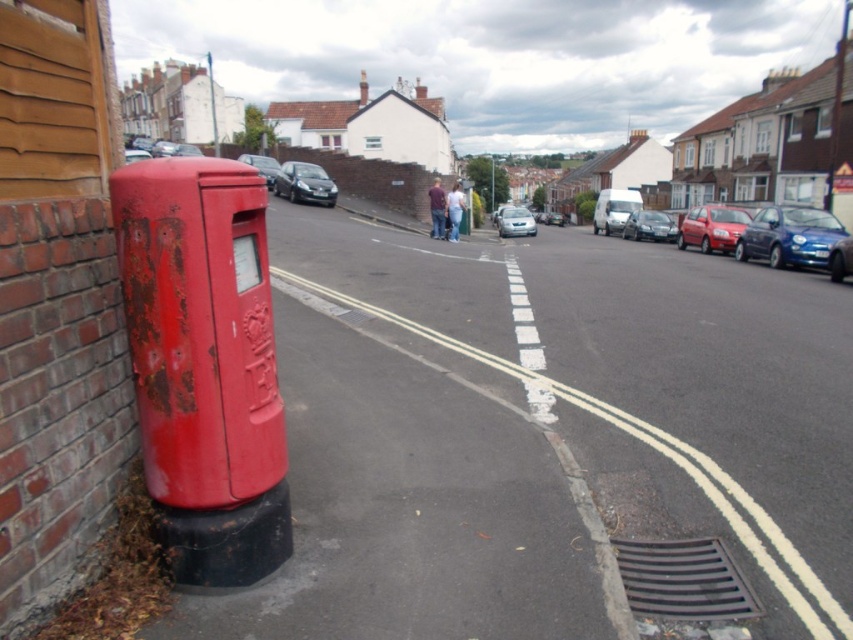
You are standing at the red postbox in the foreground of the image. Looking towards the street, you see a point marked at coordinates (788, 236). What object does this point correspond to?

The point at coordinates (788, 236) corresponds to the metallic blue car at right.